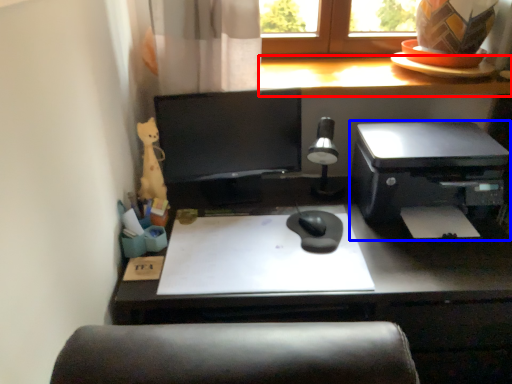
Question: Which object appears closest to the camera in this image, counter top (highlighted by a red box) or printer (highlighted by a blue box)?

Choices:
 (A) counter top
 (B) printer

Answer: (B)